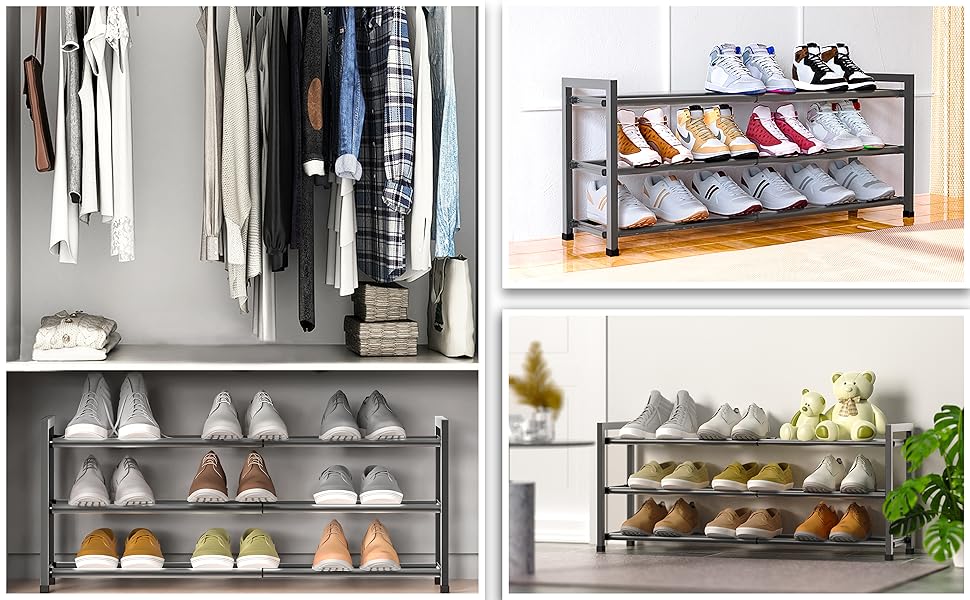
Find the location of `racks`. racks is located at coordinates (674, 228), (673, 169), (683, 100), (650, 538), (651, 493), (656, 445), (409, 568), (419, 505), (419, 432).